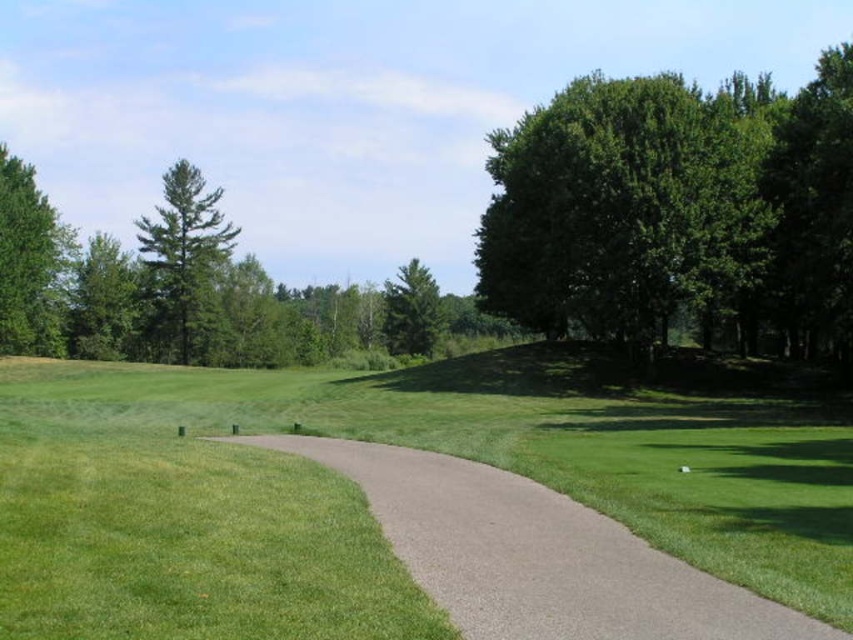
You are a golfer standing on the tee, preparing to hit your ball towards the fairway. You notice the gray asphalt path at center and the green leafy tree at left in your line of sight. Which object is closer to you, the golfer?

The gray asphalt path at center is closer to you because it is in front of the green leafy tree at left, meaning the path is between you and the tree.

You are a golfer standing on the gray asphalt path at center and want to hit the ball towards the green leafy tree at left. Considering their positions, will the tree block your direct path to the hole?

The gray asphalt path at center is located below the green leafy tree at left, so the tree is positioned above the path. This means the tree might block your direct line unless you adjust your shot to go around or over it.

You are a landscape architect designing a new golf course. You need to place a new water hazard between the green leafy tree at left and the green leafy tree at upper left. Which tree should the water hazard be closer to based on their widths?

The water hazard should be closer to the green leafy tree at left because it is wider than the green leafy tree at upper left.